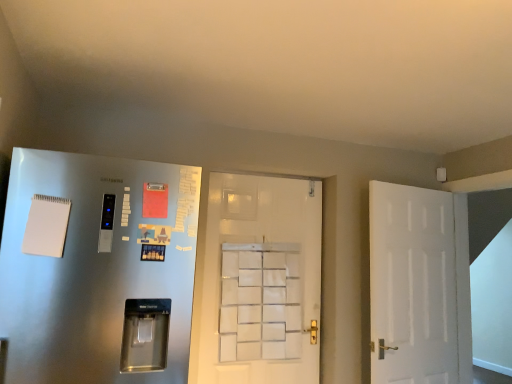
Measure the distance between white matte door at right, marked as the 1th door in a right-to-left arrangement, and camera.

white matte door at right, marked as the 1th door in a right-to-left arrangement, and camera are 8.15 feet apart from each other.

What do you see at coordinates (258, 282) in the screenshot? This screenshot has width=512, height=384. I see `white matte door at center, which is counted as the 2th door, starting from the left` at bounding box center [258, 282].

Identify the location of satin silver refrigerator at left, which ranks as the third door in right-to-left order. (95, 266).

Starting from the satin silver refrigerator at left, which ranks as the third door in right-to-left order, which door is the 2nd one to the right? Please provide its 2D coordinates.

[(418, 285)]

Between satin silver refrigerator at left, arranged as the first door when viewed from the left, and white matte door at right, the 3th door when ordered from left to right, which one has larger width?

satin silver refrigerator at left, arranged as the first door when viewed from the left.

Is the surface of satin silver refrigerator at left, which ranks as the third door in right-to-left order, in direct contact with white matte door at right, marked as the 1th door in a right-to-left arrangement?

satin silver refrigerator at left, which ranks as the third door in right-to-left order, is not next to white matte door at right, marked as the 1th door in a right-to-left arrangement, and they're not touching.

Which of these two, satin silver refrigerator at left, which ranks as the third door in right-to-left order, or white matte door at right, the 3th door when ordered from left to right, is smaller?

Smaller between the two is white matte door at right, the 3th door when ordered from left to right.

Can white matte door at center, marked as the second door in a right-to-left arrangement, be found inside white matte door at right, marked as the 1th door in a right-to-left arrangement?

No, white matte door at center, marked as the second door in a right-to-left arrangement, is not surrounded by white matte door at right, marked as the 1th door in a right-to-left arrangement.

Can you see white matte door at right, marked as the 1th door in a right-to-left arrangement, touching white matte door at center, marked as the second door in a right-to-left arrangement?

white matte door at right, marked as the 1th door in a right-to-left arrangement, and white matte door at center, marked as the second door in a right-to-left arrangement, are clearly separated.

From a real-world perspective, between white matte door at right, marked as the 1th door in a right-to-left arrangement, and white matte door at center, marked as the second door in a right-to-left arrangement, who is vertically lower?

white matte door at right, marked as the 1th door in a right-to-left arrangement, is physically lower.

From the image's perspective, is white matte door at right, the 3th door when ordered from left to right, below white matte door at center, which is counted as the 2th door, starting from the left?

Indeed, from the image's perspective, white matte door at right, the 3th door when ordered from left to right, is shown beneath white matte door at center, which is counted as the 2th door, starting from the left.

Considering the relative sizes of satin silver refrigerator at left, which ranks as the third door in right-to-left order, and white matte door at center, marked as the second door in a right-to-left arrangement, in the image provided, is satin silver refrigerator at left, which ranks as the third door in right-to-left order, smaller than white matte door at center, marked as the second door in a right-to-left arrangement,?

Incorrect, satin silver refrigerator at left, which ranks as the third door in right-to-left order, is not smaller in size than white matte door at center, marked as the second door in a right-to-left arrangement.

You are a GUI agent. You are given a task and a screenshot of the screen. Output one action in this format:
    pyautogui.click(x=<x>, y=<y>)
    Task: Click on the 2nd door in front of the white matte door at center, marked as the second door in a right-to-left arrangement
    
    Given the screenshot: What is the action you would take?
    pyautogui.click(x=95, y=266)

From the image's perspective, is satin silver refrigerator at left, which ranks as the third door in right-to-left order, beneath white matte door at center, which is counted as the 2th door, starting from the left?

No.

Between satin silver refrigerator at left, arranged as the first door when viewed from the left, and white matte door at center, which is counted as the 2th door, starting from the left, which one is positioned behind?

white matte door at center, which is counted as the 2th door, starting from the left.

Is white matte door at right, the 3th door when ordered from left to right, positioned with its back to satin silver refrigerator at left, which ranks as the third door in right-to-left order?

No, white matte door at right, the 3th door when ordered from left to right,'s orientation is not away from satin silver refrigerator at left, which ranks as the third door in right-to-left order.

I want to click on door below the white matte door at right, marked as the 1th door in a right-to-left arrangement (from a real-world perspective), so click(x=95, y=266).

From a real-world perspective, is white matte door at right, the 3th door when ordered from left to right, beneath satin silver refrigerator at left, arranged as the first door when viewed from the left?

No, from a real-world perspective, white matte door at right, the 3th door when ordered from left to right, is not below satin silver refrigerator at left, arranged as the first door when viewed from the left.

Considering the sizes of white matte door at right, the 3th door when ordered from left to right, and satin silver refrigerator at left, arranged as the first door when viewed from the left, in the image, is white matte door at right, the 3th door when ordered from left to right, wider or thinner than satin silver refrigerator at left, arranged as the first door when viewed from the left,?

Considering their sizes, white matte door at right, the 3th door when ordered from left to right, looks slimmer than satin silver refrigerator at left, arranged as the first door when viewed from the left.

Where is `door that is the 1st one below the white matte door at center, which is counted as the 2th door, starting from the left (from a real-world perspective)`? This screenshot has width=512, height=384. door that is the 1st one below the white matte door at center, which is counted as the 2th door, starting from the left (from a real-world perspective) is located at coordinates (418, 285).

Considering the sizes of objects white matte door at center, marked as the second door in a right-to-left arrangement, and white matte door at right, marked as the 1th door in a right-to-left arrangement, in the image provided, who is wider, white matte door at center, marked as the second door in a right-to-left arrangement, or white matte door at right, marked as the 1th door in a right-to-left arrangement,?

With larger width is white matte door at right, marked as the 1th door in a right-to-left arrangement.

Can you confirm if white matte door at center, which is counted as the 2th door, starting from the left, is positioned to the left of white matte door at right, the 3th door when ordered from left to right?

Yes.

Is white matte door at center, which is counted as the 2th door, starting from the left, closer to the viewer compared to white matte door at right, marked as the 1th door in a right-to-left arrangement?

That is False.

Considering the relative sizes of white matte door at center, which is counted as the 2th door, starting from the left, and satin silver refrigerator at left, which ranks as the third door in right-to-left order, in the image provided, is white matte door at center, which is counted as the 2th door, starting from the left, shorter than satin silver refrigerator at left, which ranks as the third door in right-to-left order,?

In fact, white matte door at center, which is counted as the 2th door, starting from the left, may be taller than satin silver refrigerator at left, which ranks as the third door in right-to-left order.

Is satin silver refrigerator at left, which ranks as the third door in right-to-left order, located within white matte door at center, which is counted as the 2th door, starting from the left?

No, satin silver refrigerator at left, which ranks as the third door in right-to-left order, is not a part of white matte door at center, which is counted as the 2th door, starting from the left.

What's the angular difference between white matte door at center, which is counted as the 2th door, starting from the left, and satin silver refrigerator at left, which ranks as the third door in right-to-left order,'s facing directions?

The facing directions of white matte door at center, which is counted as the 2th door, starting from the left, and satin silver refrigerator at left, which ranks as the third door in right-to-left order, are 4.24 degrees apart.

Between white matte door at center, which is counted as the 2th door, starting from the left, and satin silver refrigerator at left, arranged as the first door when viewed from the left, which one is positioned behind?

white matte door at center, which is counted as the 2th door, starting from the left, is further away from the camera.

This screenshot has height=384, width=512. Identify the location of door that appears below the white matte door at right, the 3th door when ordered from left to right (from a real-world perspective). (95, 266).

The width and height of the screenshot is (512, 384). In order to click on the 1st door above when counting from the white matte door at right, the 3th door when ordered from left to right (from the image's perspective) in this screenshot , I will do `click(258, 282)`.

From the image, which object appears to be nearer to white matte door at right, marked as the 1th door in a right-to-left arrangement, satin silver refrigerator at left, arranged as the first door when viewed from the left, or white matte door at center, marked as the second door in a right-to-left arrangement?

white matte door at center, marked as the second door in a right-to-left arrangement, is positioned closer to the anchor white matte door at right, marked as the 1th door in a right-to-left arrangement.

Based on their spatial positions, is white matte door at center, which is counted as the 2th door, starting from the left, or white matte door at right, the 3th door when ordered from left to right, further from satin silver refrigerator at left, arranged as the first door when viewed from the left?

Among the two, white matte door at right, the 3th door when ordered from left to right, is located further to satin silver refrigerator at left, arranged as the first door when viewed from the left.

From the image, which object appears to be nearer to white matte door at center, marked as the second door in a right-to-left arrangement, white matte door at right, marked as the 1th door in a right-to-left arrangement, or satin silver refrigerator at left, which ranks as the third door in right-to-left order?

white matte door at right, marked as the 1th door in a right-to-left arrangement, lies closer to white matte door at center, marked as the second door in a right-to-left arrangement, than the other object.

Based on their spatial positions, is white matte door at center, marked as the second door in a right-to-left arrangement, or satin silver refrigerator at left, arranged as the first door when viewed from the left, closer to white matte door at right, the 3th door when ordered from left to right?

white matte door at center, marked as the second door in a right-to-left arrangement, lies closer to white matte door at right, the 3th door when ordered from left to right, than the other object.

From the picture: Looking at the image, which one is located further to satin silver refrigerator at left, arranged as the first door when viewed from the left, white matte door at right, the 3th door when ordered from left to right, or white matte door at center, which is counted as the 2th door, starting from the left?

The object further to satin silver refrigerator at left, arranged as the first door when viewed from the left, is white matte door at right, the 3th door when ordered from left to right.

When comparing their distances from white matte door at center, marked as the second door in a right-to-left arrangement, does satin silver refrigerator at left, arranged as the first door when viewed from the left, or white matte door at right, the 3th door when ordered from left to right, seem further?

satin silver refrigerator at left, arranged as the first door when viewed from the left, is further to white matte door at center, marked as the second door in a right-to-left arrangement.

Where is `door between satin silver refrigerator at left, arranged as the first door when viewed from the left, and white matte door at right, the 3th door when ordered from left to right, in the horizontal direction`? The width and height of the screenshot is (512, 384). door between satin silver refrigerator at left, arranged as the first door when viewed from the left, and white matte door at right, the 3th door when ordered from left to right, in the horizontal direction is located at coordinates (258, 282).